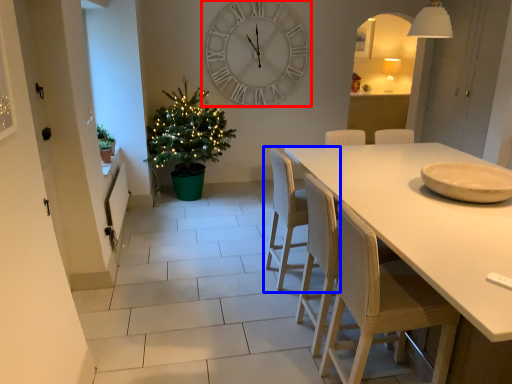
Question: Which object appears farthest to the camera in this image, wall clock (highlighted by a red box) or chair (highlighted by a blue box)?

Choices:
 (A) wall clock
 (B) chair

Answer: (A)